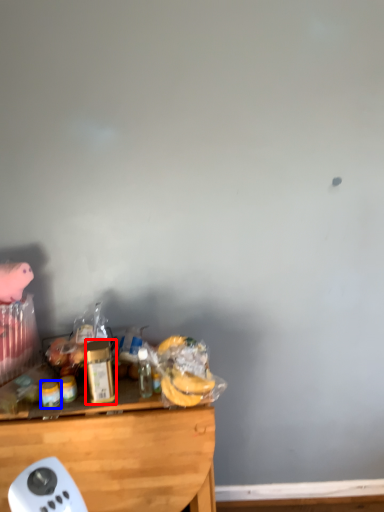
Question: Among these objects, which one is nearest to the camera, bottle (highlighted by a red box) or food (highlighted by a blue box)?

Choices:
 (A) bottle
 (B) food

Answer: (A)